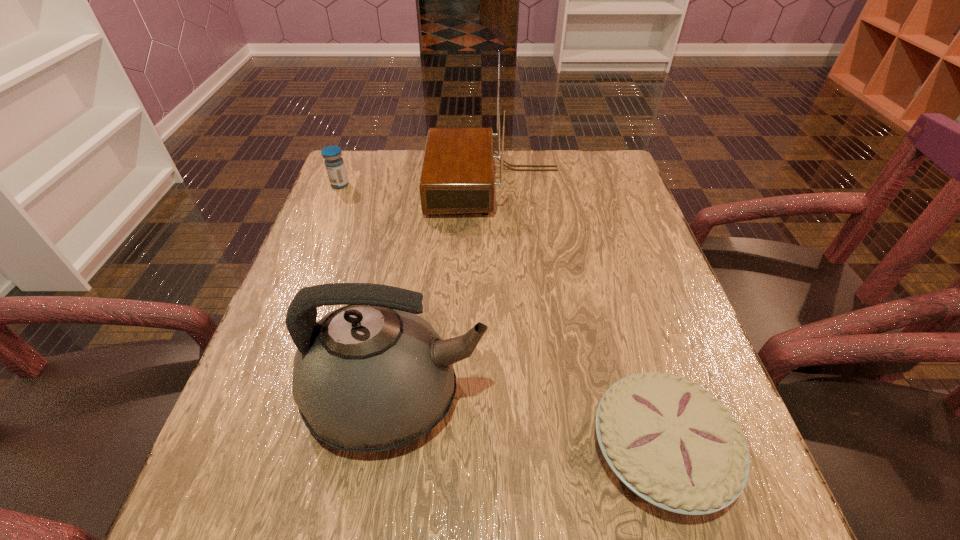
Identify the location of vacant area at the near edge of the desktop. This screenshot has height=540, width=960. (640, 518).

The height and width of the screenshot is (540, 960). In the image, there is a desktop. Find the location of `vacant region at the left edge`. vacant region at the left edge is located at coordinates (343, 211).

Identify the location of free region at the right edge of the desktop. (656, 256).

This screenshot has width=960, height=540. I want to click on free region at the near left corner of the desktop, so click(x=301, y=494).

At what (x,y) coordinates should I click in order to perform the action: click on vacant region at the far right corner of the desktop. Please return your answer as a coordinate pair (x, y). The image size is (960, 540). Looking at the image, I should click on (580, 187).

Identify the location of free spot between the radio_receiver and the third tallest object. This screenshot has height=540, width=960. (417, 185).

Identify the location of free space that is in between the shortest object and the kettle. The height and width of the screenshot is (540, 960). (529, 424).

Find the location of a particular element. Image resolution: width=960 pixels, height=540 pixels. unoccupied position between the third tallest object and the radio_receiver is located at coordinates (417, 185).

Locate an element on the screen. Image resolution: width=960 pixels, height=540 pixels. vacant area between the radio_receiver and the medicine is located at coordinates (417, 185).

Where is `vacant space that is in between the pie and the radio_receiver`? Image resolution: width=960 pixels, height=540 pixels. vacant space that is in between the pie and the radio_receiver is located at coordinates (578, 317).